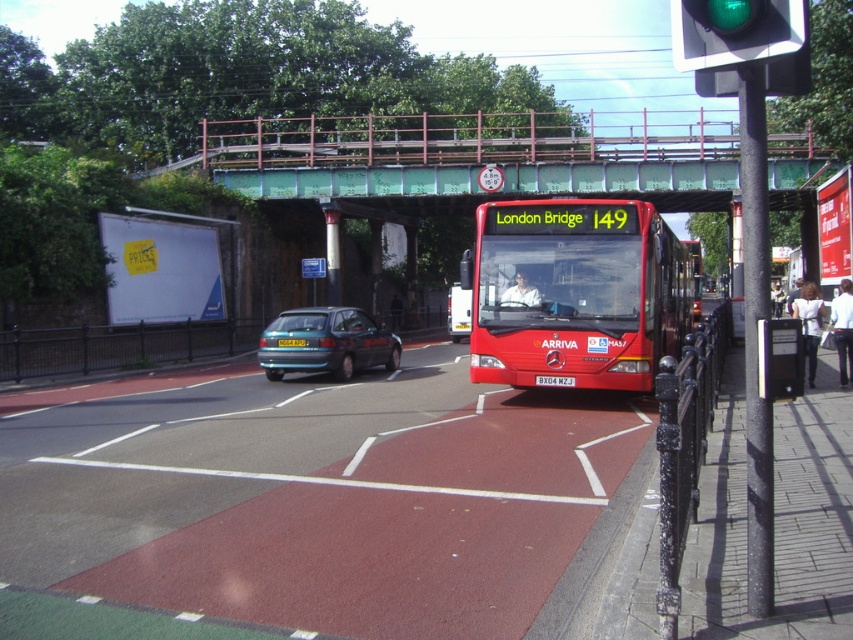
Question: Among these points, which one is farthest from the camera?

Choices:
 (A) (728, 20)
 (B) (300, 339)
 (C) (509, 348)
 (D) (398, 353)

Answer: (D)

Question: Is green glass traffic light at upper right thinner than white plastic license plate at center?

Choices:
 (A) no
 (B) yes

Answer: (A)

Question: Which point is farther to the camera?

Choices:
 (A) coord(277,340)
 (B) coord(749,8)
 (C) coord(312,307)
 (D) coord(347,166)

Answer: (D)

Question: Does red matte bus at center appear on the right side of green glass traffic light at upper right?

Choices:
 (A) no
 (B) yes

Answer: (B)

Question: Can you confirm if white plastic license plate at center is positioned above yellow metallic license plate at center?

Choices:
 (A) no
 (B) yes

Answer: (A)

Question: Which point is farther to the camera?

Choices:
 (A) red matte bus at center
 (B) white plastic license plate at center
 (C) green glass traffic light at upper right
 (D) green painted steel bridge at upper center

Answer: (D)